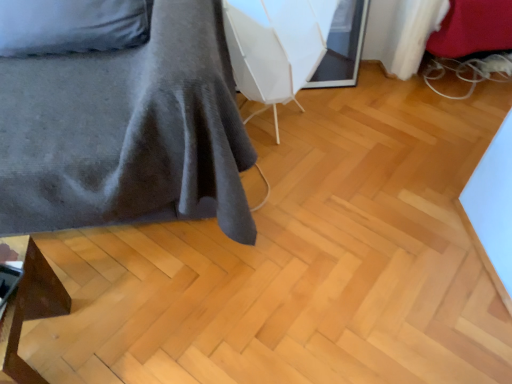
I want to click on velvet grey bedspread at left, positioned as the second furniture in bottom-to-top order, so click(x=127, y=132).

What are the coordinates of `matte brown wooden stool at lower left, the first furniture ordered from the bottom` in the screenshot? It's located at pyautogui.click(x=28, y=304).

Is white plastic swivel chair at center closer to camera compared to matte brown wooden stool at lower left, the first furniture ordered from the bottom?

That is False.

Is white plastic swivel chair at center facing towards matte brown wooden stool at lower left, the first furniture ordered from the bottom?

No.

Consider the image. Considering the positions of objects white plastic swivel chair at center and matte brown wooden stool at lower left, which ranks as the 2th furniture in top-to-bottom order, in the image provided, who is more to the left, white plastic swivel chair at center or matte brown wooden stool at lower left, which ranks as the 2th furniture in top-to-bottom order,?

Positioned to the left is matte brown wooden stool at lower left, which ranks as the 2th furniture in top-to-bottom order.

Can matte brown wooden stool at lower left, which ranks as the 2th furniture in top-to-bottom order, be found inside white plastic swivel chair at center?

No, white plastic swivel chair at center does not contain matte brown wooden stool at lower left, which ranks as the 2th furniture in top-to-bottom order.

Is velvet grey bedspread at left, the 1th furniture in the top-to-bottom sequence, smaller than white plastic swivel chair at center?

No, velvet grey bedspread at left, the 1th furniture in the top-to-bottom sequence, is not smaller than white plastic swivel chair at center.

Based on the photo, from the image's perspective, which object appears higher, velvet grey bedspread at left, the 1th furniture in the top-to-bottom sequence, or white plastic swivel chair at center?

white plastic swivel chair at center appears higher in the image.

Could you tell me if velvet grey bedspread at left, the 1th furniture in the top-to-bottom sequence, is turned towards white plastic swivel chair at center?

No, velvet grey bedspread at left, the 1th furniture in the top-to-bottom sequence, is not oriented towards white plastic swivel chair at center.

Is velvet grey bedspread at left, positioned as the second furniture in bottom-to-top order, not inside white plastic swivel chair at center?

That's correct, velvet grey bedspread at left, positioned as the second furniture in bottom-to-top order, is outside of white plastic swivel chair at center.

Are white plastic swivel chair at center and velvet grey bedspread at left, the 1th furniture in the top-to-bottom sequence, making contact?

There is a gap between white plastic swivel chair at center and velvet grey bedspread at left, the 1th furniture in the top-to-bottom sequence.

Is velvet grey bedspread at left, positioned as the second furniture in bottom-to-top order, at the back of white plastic swivel chair at center?

No, white plastic swivel chair at center's orientation is not away from velvet grey bedspread at left, positioned as the second furniture in bottom-to-top order.

This screenshot has height=384, width=512. Find the location of `the 1st furniture below the white plastic swivel chair at center (from the image's perspective)`. the 1st furniture below the white plastic swivel chair at center (from the image's perspective) is located at coordinates (127, 132).

Can you confirm if white plastic swivel chair at center is shorter than velvet grey bedspread at left, positioned as the second furniture in bottom-to-top order?

Yes.

In terms of height, does matte brown wooden stool at lower left, the first furniture ordered from the bottom, look taller or shorter compared to velvet grey bedspread at left, the 1th furniture in the top-to-bottom sequence?

Clearly, matte brown wooden stool at lower left, the first furniture ordered from the bottom, is shorter compared to velvet grey bedspread at left, the 1th furniture in the top-to-bottom sequence.

Is matte brown wooden stool at lower left, the first furniture ordered from the bottom, not inside velvet grey bedspread at left, the 1th furniture in the top-to-bottom sequence?

Yes, matte brown wooden stool at lower left, the first furniture ordered from the bottom, is outside of velvet grey bedspread at left, the 1th furniture in the top-to-bottom sequence.

Are matte brown wooden stool at lower left, the first furniture ordered from the bottom, and velvet grey bedspread at left, positioned as the second furniture in bottom-to-top order, making contact?

They are not placed beside each other.

Is point (78, 124) closer or farther from the camera than point (9, 349)?

Point (78, 124) appears to be farther away from the viewer than point (9, 349).

Are velvet grey bedspread at left, the 1th furniture in the top-to-bottom sequence, and matte brown wooden stool at lower left, which ranks as the 2th furniture in top-to-bottom order, located far from each other?

They are positioned close to each other.

Is matte brown wooden stool at lower left, which ranks as the 2th furniture in top-to-bottom order, located within velvet grey bedspread at left, positioned as the second furniture in bottom-to-top order?

No, velvet grey bedspread at left, positioned as the second furniture in bottom-to-top order, does not contain matte brown wooden stool at lower left, which ranks as the 2th furniture in top-to-bottom order.

Which is closer, (0, 362) or (237, 49)?

The point (0, 362) is in front.

Locate an element on the screen. Image resolution: width=512 pixels, height=384 pixels. swivel chair above the matte brown wooden stool at lower left, which ranks as the 2th furniture in top-to-bottom order (from the image's perspective) is located at coordinates (275, 46).

From a real-world perspective, is matte brown wooden stool at lower left, which ranks as the 2th furniture in top-to-bottom order, physically below white plastic swivel chair at center?

Yes, from a real-world perspective, matte brown wooden stool at lower left, which ranks as the 2th furniture in top-to-bottom order, is under white plastic swivel chair at center.

Locate an element on the screen. swivel chair located above the matte brown wooden stool at lower left, the first furniture ordered from the bottom (from the image's perspective) is located at coordinates (275, 46).

This screenshot has width=512, height=384. What are the coordinates of `swivel chair below the velvet grey bedspread at left, positioned as the second furniture in bottom-to-top order (from a real-world perspective)` in the screenshot? It's located at (275, 46).

Which object lies further to the anchor point white plastic swivel chair at center, velvet grey bedspread at left, the 1th furniture in the top-to-bottom sequence, or matte brown wooden stool at lower left, the first furniture ordered from the bottom?

matte brown wooden stool at lower left, the first furniture ordered from the bottom, lies further to white plastic swivel chair at center than the other object.

From the image, which object appears to be nearer to matte brown wooden stool at lower left, which ranks as the 2th furniture in top-to-bottom order, white plastic swivel chair at center or velvet grey bedspread at left, positioned as the second furniture in bottom-to-top order?

velvet grey bedspread at left, positioned as the second furniture in bottom-to-top order, is closer to matte brown wooden stool at lower left, which ranks as the 2th furniture in top-to-bottom order.

From the image, which object appears to be farther from white plastic swivel chair at center, matte brown wooden stool at lower left, the first furniture ordered from the bottom, or velvet grey bedspread at left, the 1th furniture in the top-to-bottom sequence?

Answer: Among the two, matte brown wooden stool at lower left, the first furniture ordered from the bottom, is located further to white plastic swivel chair at center.

Based on their spatial positions, is white plastic swivel chair at center or matte brown wooden stool at lower left, the first furniture ordered from the bottom, closer to velvet grey bedspread at left, positioned as the second furniture in bottom-to-top order?

The object closer to velvet grey bedspread at left, positioned as the second furniture in bottom-to-top order, is white plastic swivel chair at center.

Estimate the real-world distances between objects in this image. Which object is closer to matte brown wooden stool at lower left, the first furniture ordered from the bottom, velvet grey bedspread at left, positioned as the second furniture in bottom-to-top order, or white plastic swivel chair at center?

velvet grey bedspread at left, positioned as the second furniture in bottom-to-top order, is positioned closer to the anchor matte brown wooden stool at lower left, the first furniture ordered from the bottom.

Which object lies nearer to the anchor point velvet grey bedspread at left, positioned as the second furniture in bottom-to-top order, matte brown wooden stool at lower left, the first furniture ordered from the bottom, or white plastic swivel chair at center?

The object closer to velvet grey bedspread at left, positioned as the second furniture in bottom-to-top order, is white plastic swivel chair at center.

This screenshot has height=384, width=512. In order to click on furniture between white plastic swivel chair at center and matte brown wooden stool at lower left, the first furniture ordered from the bottom, from top to bottom in this screenshot , I will do `click(127, 132)`.